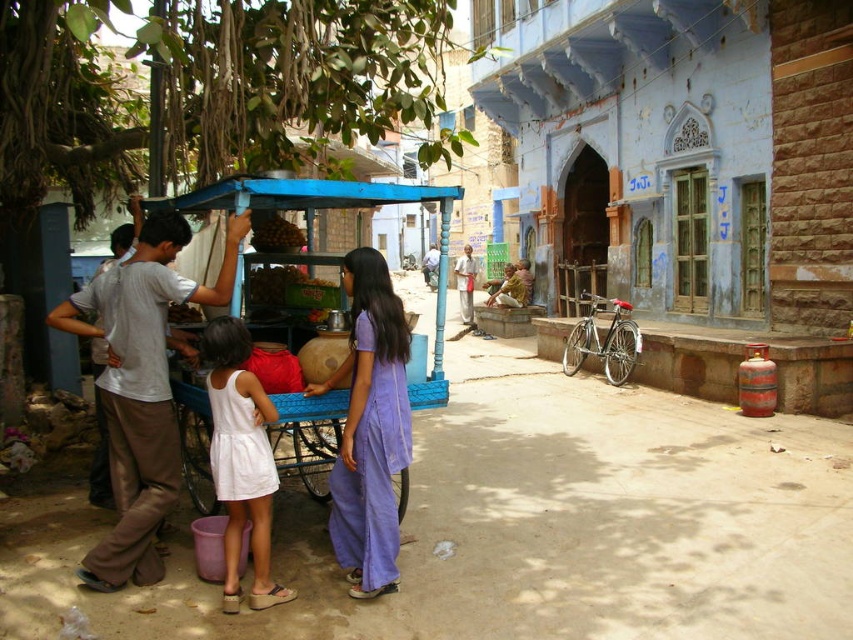
You are a customer at the blue cart under the tree. You want to buy something from the seller. Which direction should you walk to approach the seller wearing the light brown cotton shirt at center from the purple cotton dress at center?

The purple cotton dress at center is to the left of the light brown cotton shirt at center, so you should walk to the right to approach the seller wearing the light brown cotton shirt at center from the purple cotton dress at center.

You are a photographer standing in front of the blue cart. You want to take a photo that includes both the white cotton dress at lower left and the light brown cotton shirt at center. Which of the two items is positioned lower in the frame?

The white cotton dress at lower left is positioned lower in the frame than the light brown cotton shirt at center.